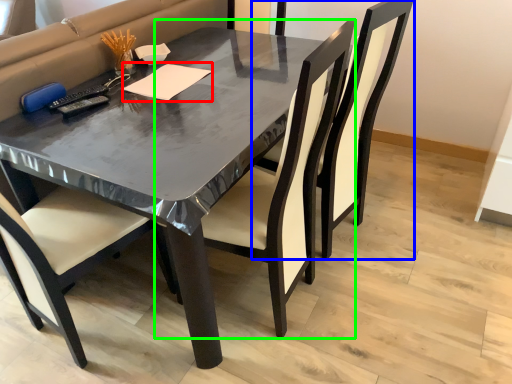
Question: Which is farther away from notepad (highlighted by a red box)? chair (highlighted by a blue box) or chair (highlighted by a green box)?

Choices:
 (A) chair
 (B) chair

Answer: (A)